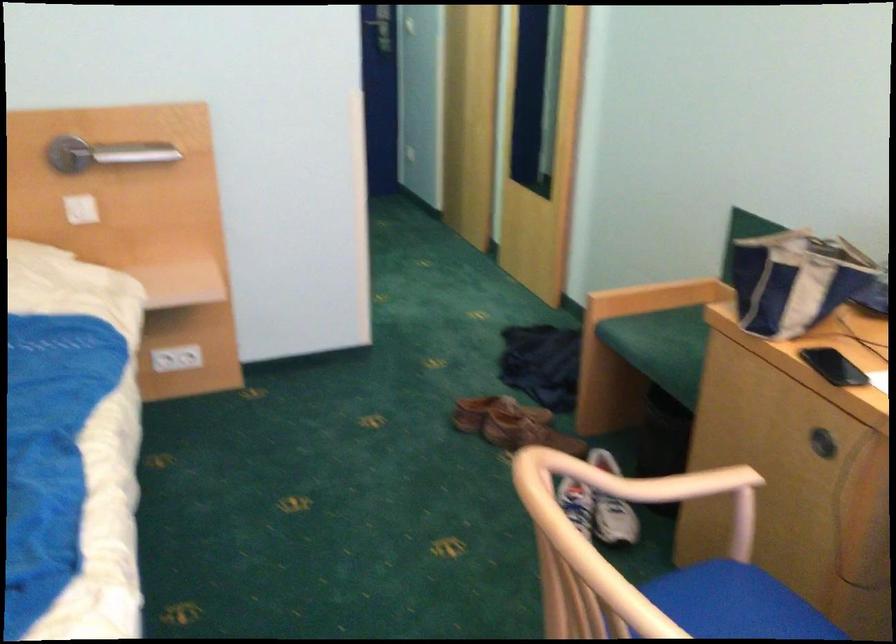
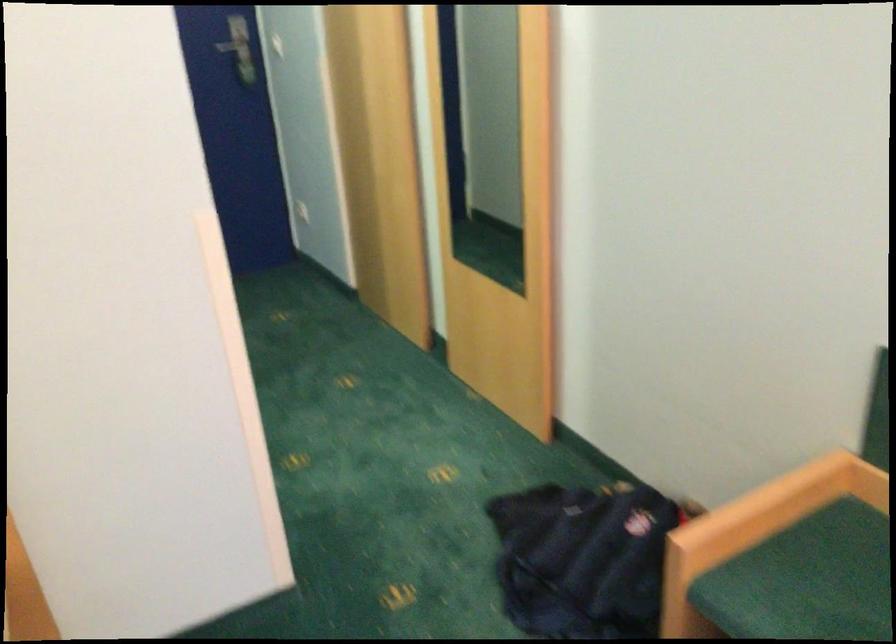
Question: The images are taken continuously from a first-person perspective. In which direction are you moving?

Choices:
 (A) Left
 (B) Right
 (C) Forward
 (D) Backward

Answer: (C)